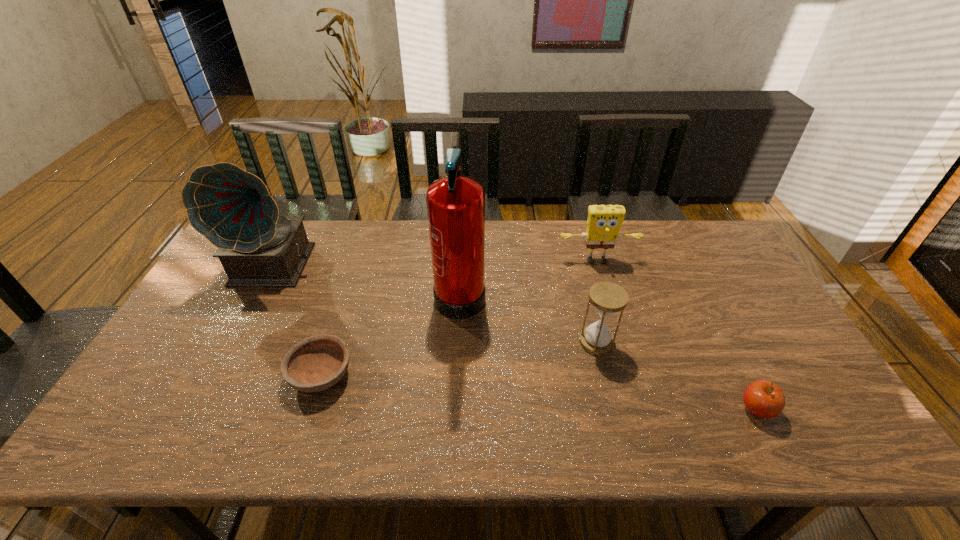
What are the coordinates of `blank space that satisfies the following two spatial constraints: 1. on the horn of the bowl; 2. on the left side of the second tallest object` in the screenshot? It's located at (220, 375).

Where is `free region that satisfies the following two spatial constraints: 1. on the horn of the second shortest object; 2. on the left side of the leftmost object`? free region that satisfies the following two spatial constraints: 1. on the horn of the second shortest object; 2. on the left side of the leftmost object is located at coordinates (202, 409).

Locate an element on the screen. The width and height of the screenshot is (960, 540). free space that satisfies the following two spatial constraints: 1. on the horn of the second tallest object; 2. on the right side of the shortest object is located at coordinates (220, 375).

Find the location of `vacant position in the image that satisfies the following two spatial constraints: 1. on the horn of the leftmost object; 2. on the left side of the hourglass`. vacant position in the image that satisfies the following two spatial constraints: 1. on the horn of the leftmost object; 2. on the left side of the hourglass is located at coordinates (237, 342).